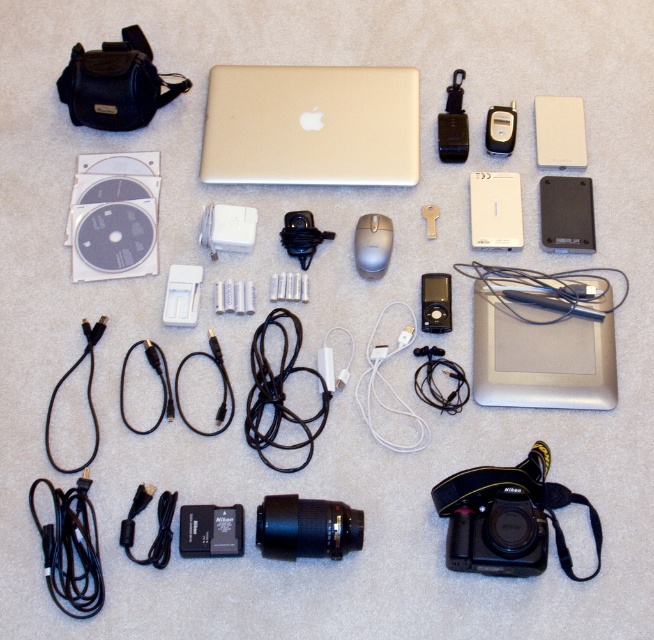
Question: Is black plastic lens at center smaller than white plastic ipod at upper right?

Choices:
 (A) yes
 (B) no

Answer: (A)

Question: Which point appears closest to the camera in this image?

Choices:
 (A) (284, 499)
 (B) (545, 136)

Answer: (A)

Question: Which point is farther to the camera?

Choices:
 (A) black rubber camera at center
 (B) black plastic charger at center

Answer: (B)

Question: Which object is the closest to the black plastic charger at center?

Choices:
 (A) satin black ipod at center
 (B) satin silver ipod at center
 (C) silver metallic mouse at center

Answer: (C)

Question: Can you confirm if black plastic lens at center is wider than black plastic hard drive at upper right?

Choices:
 (A) no
 (B) yes

Answer: (B)

Question: Does black plastic charger at center have a greater width compared to black plastic digital camera at upper right?

Choices:
 (A) yes
 (B) no

Answer: (A)